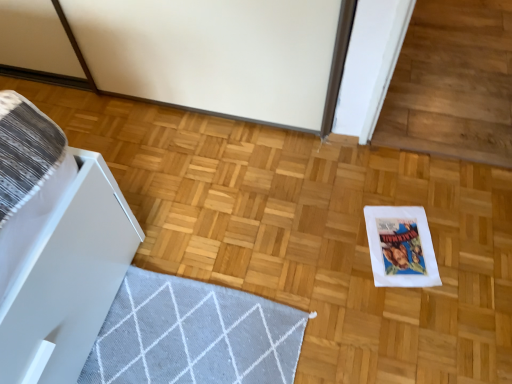
You are a GUI agent. You are given a task and a screenshot of the screen. Output one action in this format:
    pyautogui.click(x=<x>, y=<y>)
    Task: Click on the blank space situated above matte white comic book at lower right (from a real-world perspective)
    The width and height of the screenshot is (512, 384).
    Given the screenshot: What is the action you would take?
    pyautogui.click(x=399, y=244)